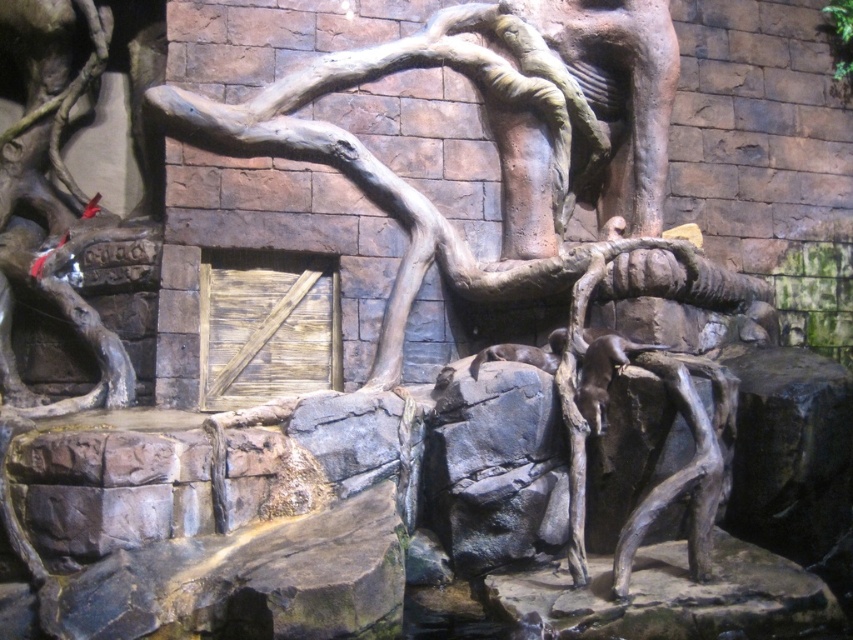
Is point (689, 483) less distant than point (627, 353)?

Yes, point (689, 483) is in front of point (627, 353).

Is rustic wood tree trunk at center thinner than brown furry otter at center-right?

No.

What do you see at coordinates (503, 168) in the screenshot? I see `rustic wood tree trunk at center` at bounding box center [503, 168].

Locate an element on the screen. rustic wood tree trunk at center is located at coordinates (x=503, y=168).

The image size is (853, 640). What do you see at coordinates (503, 168) in the screenshot? I see `rustic wood tree trunk at center` at bounding box center [503, 168].

Between rustic wood tree trunk at center and brown furry otter at center, which one has more height?

rustic wood tree trunk at center

Locate an element on the screen. The image size is (853, 640). rustic wood tree trunk at center is located at coordinates (503, 168).

Does brown furry otter at center-right appear on the left side of brown furry otter at center?

Incorrect, brown furry otter at center-right is not on the left side of brown furry otter at center.

Does point (619, 344) come in front of point (547, 365)?

Yes, it is.

The image size is (853, 640). What are the coordinates of `brown furry otter at center-right` in the screenshot? It's located at (602, 374).